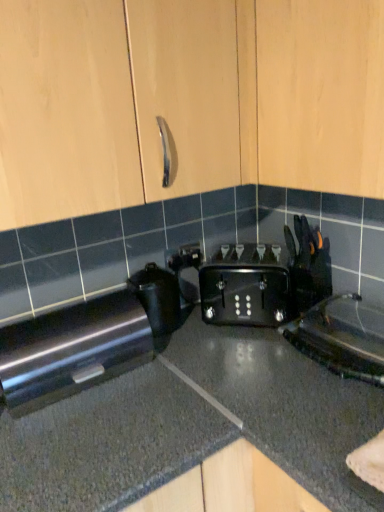
Find the location of `vacant area in front of black plastic toaster at center, which ranks as the 2th appliance in right-to-left order`. vacant area in front of black plastic toaster at center, which ranks as the 2th appliance in right-to-left order is located at coordinates tap(181, 355).